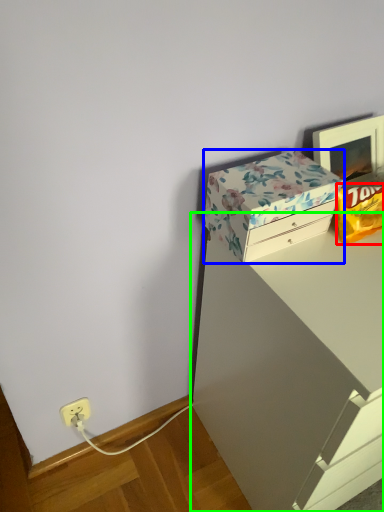
Question: Considering the real-world distances, which object is farthest from wrapping paper (highlighted by a red box)? box (highlighted by a blue box) or vanity (highlighted by a green box)?

Choices:
 (A) box
 (B) vanity

Answer: (B)